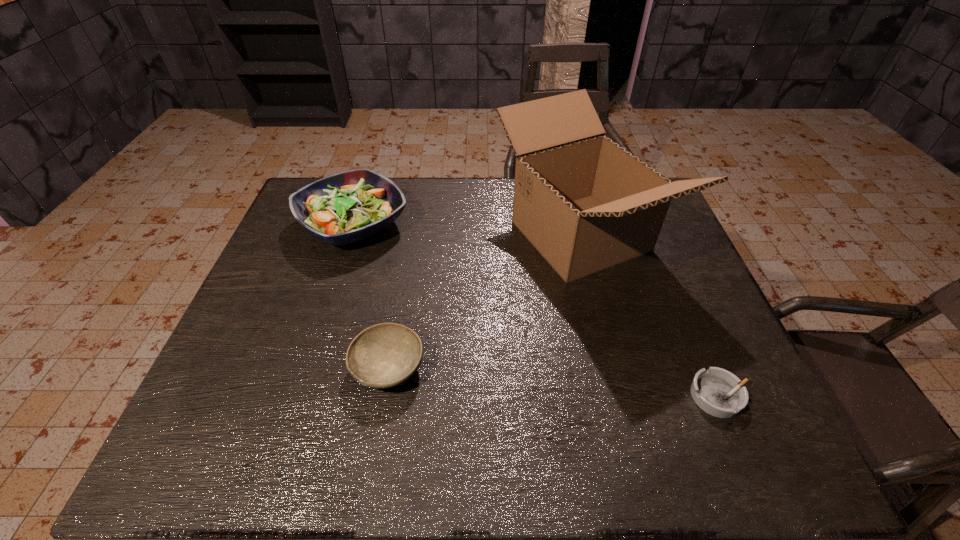
Find the location of a particular element. The width and height of the screenshot is (960, 540). vacant area that lies between the bowl and the shortest object is located at coordinates (553, 382).

The height and width of the screenshot is (540, 960). I want to click on free spot between the box and the salad plate, so click(467, 230).

This screenshot has height=540, width=960. Find the location of `vacant space that is in between the bowl and the third shortest object`. vacant space that is in between the bowl and the third shortest object is located at coordinates (371, 296).

Where is `free point between the tallest object and the second shortest object`? The width and height of the screenshot is (960, 540). free point between the tallest object and the second shortest object is located at coordinates (484, 302).

Identify the location of free space between the shortest object and the salad plate. (536, 310).

Locate an element on the screen. The height and width of the screenshot is (540, 960). empty space that is in between the second tallest object and the box is located at coordinates (467, 230).

Locate an element on the screen. The image size is (960, 540). blank region between the ashtray and the second shortest object is located at coordinates (553, 382).

What are the coordinates of `free area in between the shortest object and the tallest object` in the screenshot? It's located at (649, 316).

This screenshot has height=540, width=960. I want to click on the second closest object relative to the bowl, so click(x=349, y=206).

The height and width of the screenshot is (540, 960). Identify the location of the closest object to the shortest object. (585, 203).